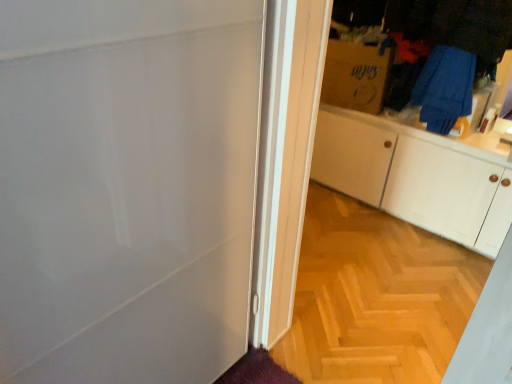
Question: From the image's perspective, is wooden floor at center above or below blue fabric at upper right, which is the 2th laundry from bottom to top?

Choices:
 (A) below
 (B) above

Answer: (A)

Question: Considering their positions, is wooden floor at center located in front of or behind blue fabric at upper right, which is the 2th laundry from bottom to top?

Choices:
 (A) behind
 (B) front

Answer: (B)

Question: Which object is positioned closest to the white matte cabinet at right?

Choices:
 (A) blue fabric at upper right, which is counted as the 1th laundry, starting from the top
 (B) wooden floor at center
 (C) brown cardboard box at upper right
 (D) blue fabric laundry at upper right, the first laundry in the bottom-to-top sequence

Answer: (D)

Question: Which of these objects is positioned closest to the brown cardboard box at upper right?

Choices:
 (A) wooden floor at center
 (B) blue fabric at upper right, which is counted as the 1th laundry, starting from the top
 (C) white matte cabinet at right
 (D) blue fabric laundry at upper right, the second laundry positioned from the top

Answer: (B)